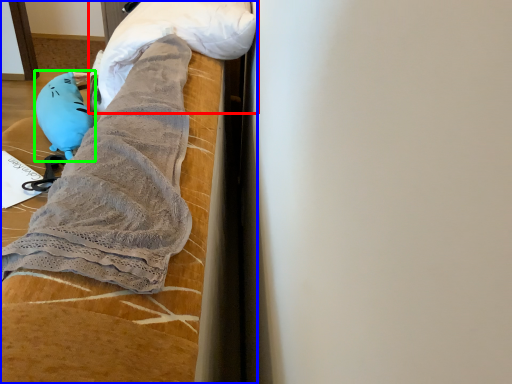
Question: Estimate the real-world distances between objects in this image. Which object is closer to wrap (highlighted by a red box), furniture (highlighted by a blue box) or toy (highlighted by a green box)?

Choices:
 (A) furniture
 (B) toy

Answer: (A)